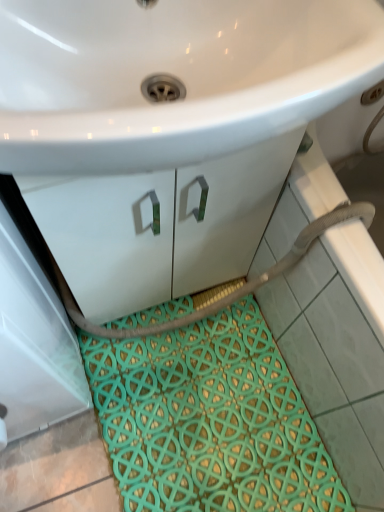
Question: Is white glossy sink at upper center next to teal woven bath mat at lower center?

Choices:
 (A) no
 (B) yes

Answer: (A)

Question: Is teal woven bath mat at lower center surrounded by white glossy sink at upper center?

Choices:
 (A) yes
 (B) no

Answer: (B)

Question: Is white glossy sink at upper center facing away from teal woven bath mat at lower center?

Choices:
 (A) no
 (B) yes

Answer: (A)

Question: Is white glossy sink at upper center facing towards teal woven bath mat at lower center?

Choices:
 (A) yes
 (B) no

Answer: (B)

Question: Considering the relative positions of white glossy sink at upper center and teal woven bath mat at lower center in the image provided, is white glossy sink at upper center to the left of teal woven bath mat at lower center from the viewer's perspective?

Choices:
 (A) no
 (B) yes

Answer: (B)

Question: Is white glossy sink at upper center taller than teal woven bath mat at lower center?

Choices:
 (A) yes
 (B) no

Answer: (A)

Question: Could you tell me if teal woven bath mat at lower center is turned towards white glossy sink at upper center?

Choices:
 (A) yes
 (B) no

Answer: (B)

Question: Is teal woven bath mat at lower center outside of white glossy sink at upper center?

Choices:
 (A) yes
 (B) no

Answer: (A)

Question: Considering the relative sizes of teal woven bath mat at lower center and white glossy sink at upper center in the image provided, is teal woven bath mat at lower center thinner than white glossy sink at upper center?

Choices:
 (A) no
 (B) yes

Answer: (A)

Question: Is there a large distance between teal woven bath mat at lower center and white glossy sink at upper center?

Choices:
 (A) no
 (B) yes

Answer: (A)

Question: From a real-world perspective, does teal woven bath mat at lower center stand above white glossy sink at upper center?

Choices:
 (A) yes
 (B) no

Answer: (B)

Question: Considering the relative positions of teal woven bath mat at lower center and white glossy sink at upper center in the image provided, is teal woven bath mat at lower center to the right of white glossy sink at upper center from the viewer's perspective?

Choices:
 (A) no
 (B) yes

Answer: (B)

Question: From the image's perspective, is teal woven bath mat at lower center above or below white glossy sink at upper center?

Choices:
 (A) below
 (B) above

Answer: (A)